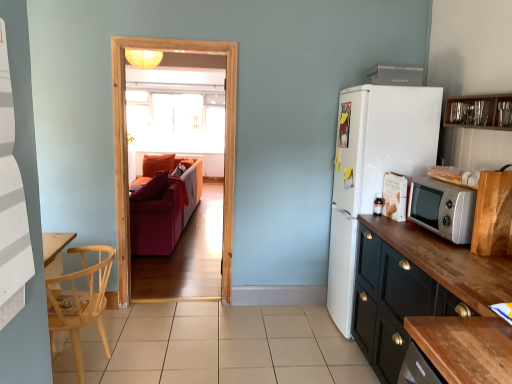
In order to face white matte refrigerator at right, should I rotate leftwards or rightwards?

To face it directly, rotate right by 16.661 degrees.

What is the approximate width of velvet red couch at center?

The width of velvet red couch at center is 3.47 feet.

I want to click on white plastic microwave at upper right, so click(395, 74).

What do you see at coordinates (442, 208) in the screenshot?
I see `silver metallic microwave oven at right` at bounding box center [442, 208].

What do you see at coordinates (392, 303) in the screenshot? I see `black wood cabinet at right, which is the third cabinetry from top to bottom` at bounding box center [392, 303].

At what (x,y) coordinates should I click in order to perform the action: click on white matte refrigerator at right. Please return your answer as a coordinate pair (x, y). The image size is (512, 384). Looking at the image, I should click on (373, 168).

Is point (495, 105) positioned before point (243, 321)?

Yes, it is.

Is clear glass cabinet at upper right, which appears as the third cabinetry when ordered from the bottom, aimed at beige tile at center?

No, clear glass cabinet at upper right, which appears as the third cabinetry when ordered from the bottom, does not turn towards beige tile at center.

Considering the sizes of objects clear glass cabinet at upper right, which appears as the third cabinetry when ordered from the bottom, and beige tile at center in the image provided, who is shorter, clear glass cabinet at upper right, which appears as the third cabinetry when ordered from the bottom, or beige tile at center?

Standing shorter between the two is beige tile at center.

From the image's perspective, who appears lower, clear glass cabinet at upper right, which is the first cabinetry in top-to-bottom order, or beige tile at center?

beige tile at center appears lower in the image.

Is white plastic microwave at upper right aimed at silver metallic microwave oven at right?

No.

How different are the orientations of white plastic microwave at upper right and silver metallic microwave oven at right in degrees?

The angle between the facing direction of white plastic microwave at upper right and the facing direction of silver metallic microwave oven at right is 11.7 degrees.

Consider the image. Which point is more forward, (413, 67) or (472, 226)?

Point (472, 226)

What's the angular difference between wooden cabinet at right, arranged as the second cabinetry when ordered from the bottom, and velvet red couch at center's facing directions?

The angular difference between wooden cabinet at right, arranged as the second cabinetry when ordered from the bottom, and velvet red couch at center is 8.83 degrees.

Considering the sizes of objects wooden cabinet at right, which ranks as the 2th cabinetry in top-to-bottom order, and velvet red couch at center in the image provided, who is smaller, wooden cabinet at right, which ranks as the 2th cabinetry in top-to-bottom order, or velvet red couch at center?

wooden cabinet at right, which ranks as the 2th cabinetry in top-to-bottom order, is smaller.

Which object is positioned more to the left, wooden cabinet at right, arranged as the second cabinetry when ordered from the bottom, or velvet red couch at center?

velvet red couch at center is more to the left.

Looking at this image, from a real-world perspective, does wooden cabinet at right, arranged as the second cabinetry when ordered from the bottom, stand above velvet red couch at center?

Yes, from a real-world perspective, wooden cabinet at right, arranged as the second cabinetry when ordered from the bottom, is above velvet red couch at center.

Is transparent glass door at center next to white matte refrigerator at right?

transparent glass door at center is not next to white matte refrigerator at right, and they're not touching.

From the image's perspective, would you say transparent glass door at center is shown under white matte refrigerator at right?

Actually, transparent glass door at center appears above white matte refrigerator at right in the image.

Which of these two, transparent glass door at center or white matte refrigerator at right, is wider?

white matte refrigerator at right is wider.

From a real-world perspective, is transparent glass door at center on white matte refrigerator at right?

Yes, from a real-world perspective, transparent glass door at center is over white matte refrigerator at right

In terms of width, does white matte refrigerator at right look wider or thinner when compared to natural wood chair at left?

white matte refrigerator at right is wider than natural wood chair at left.

Is natural wood chair at left at the back of white matte refrigerator at right?

No, white matte refrigerator at right's orientation is not away from natural wood chair at left.

Does white matte refrigerator at right come in front of natural wood chair at left?

No.

Is point (381, 144) positioned before point (98, 256)?

No, (381, 144) is behind (98, 256).

Who is bigger, silver metallic microwave oven at right or velvet red couch at center?

Bigger between the two is velvet red couch at center.

Is silver metallic microwave oven at right far from velvet red couch at center?

That's right, there is a large distance between silver metallic microwave oven at right and velvet red couch at center.

Who is taller, silver metallic microwave oven at right or velvet red couch at center?

velvet red couch at center is taller.

Does clear glass cabinet at upper right, which appears as the third cabinetry when ordered from the bottom, have a smaller size compared to clear glass window at center?

Yes.

Which is farther, (500, 107) or (208, 94)?

Positioned behind is point (208, 94).

From the image's perspective, is clear glass cabinet at upper right, which appears as the third cabinetry when ordered from the bottom, above or below clear glass window at center?

clear glass cabinet at upper right, which appears as the third cabinetry when ordered from the bottom, is situated lower than clear glass window at center in the image.

How many degrees apart are the facing directions of clear glass cabinet at upper right, which appears as the third cabinetry when ordered from the bottom, and clear glass window at center?

89.4 degrees separate the facing orientations of clear glass cabinet at upper right, which appears as the third cabinetry when ordered from the bottom, and clear glass window at center.

You are a GUI agent. You are given a task and a screenshot of the screen. Output one action in this format:
    pyautogui.click(x=<x>, y=<y>)
    Task: Click on the 3rd cabinetry above the beige tile at center (from a real-world perspective)
    Image resolution: width=512 pixels, height=384 pixels.
    Given the screenshot: What is the action you would take?
    pyautogui.click(x=480, y=111)

Where is `microwave oven located in front of the white plastic microwave at upper right`? microwave oven located in front of the white plastic microwave at upper right is located at coordinates (442, 208).

Considering their positions, is white matte refrigerator at right positioned further to clear glass window at center than silver metallic microwave oven at right?

silver metallic microwave oven at right lies further to clear glass window at center than the other object.

Considering their positions, is white plastic microwave at upper right positioned further to wooden cabinet at right, arranged as the second cabinetry when ordered from the bottom, than velvet red couch at center?

Based on the image, velvet red couch at center appears to be further to wooden cabinet at right, arranged as the second cabinetry when ordered from the bottom.

Which object lies further to the anchor point wooden cabinet at right, which ranks as the 2th cabinetry in top-to-bottom order, beige tile at center or black wood cabinet at right, which appears as the first cabinetry when ordered from the bottom?

beige tile at center.

From the image, which object appears to be farther from beige tile at center, transparent glass door at center or white plastic microwave at upper right?

white plastic microwave at upper right is positioned further to the anchor beige tile at center.

When comparing their distances from clear glass cabinet at upper right, which is the first cabinetry in top-to-bottom order, does wooden cabinet at right, arranged as the second cabinetry when ordered from the bottom, or white plastic microwave at upper right seem closer?

Among the two, white plastic microwave at upper right is located nearer to clear glass cabinet at upper right, which is the first cabinetry in top-to-bottom order.

Looking at the image, which one is located further to white matte refrigerator at right, silver metallic microwave oven at right or natural wood chair at left?

natural wood chair at left.

Looking at this image, from the image, which object appears to be farther from natural wood chair at left, beige tile at center or transparent glass door at center?

transparent glass door at center is positioned further to the anchor natural wood chair at left.

Looking at the image, which one is located further to clear glass cabinet at upper right, which appears as the third cabinetry when ordered from the bottom, wooden cabinet at right, arranged as the second cabinetry when ordered from the bottom, or black wood cabinet at right, which appears as the first cabinetry when ordered from the bottom?

black wood cabinet at right, which appears as the first cabinetry when ordered from the bottom.

The height and width of the screenshot is (384, 512). Find the location of `appliance between transparent glass door at center and clear glass cabinet at upper right, which appears as the third cabinetry when ordered from the bottom, in the horizontal direction`. appliance between transparent glass door at center and clear glass cabinet at upper right, which appears as the third cabinetry when ordered from the bottom, in the horizontal direction is located at coordinates (395, 74).

The width and height of the screenshot is (512, 384). In order to click on appliance between silver metallic microwave oven at right and velvet red couch at center along the z-axis in this screenshot , I will do `click(395, 74)`.

Where is `tile between wooden cabinet at right, arranged as the second cabinetry when ordered from the bottom, and clear glass window at center from front to back`? This screenshot has height=384, width=512. tile between wooden cabinet at right, arranged as the second cabinetry when ordered from the bottom, and clear glass window at center from front to back is located at coordinates pos(222,346).

The image size is (512, 384). Find the location of `refrigerator positioned between black wood cabinet at right, which is the third cabinetry from top to bottom, and clear glass window at center from near to far`. refrigerator positioned between black wood cabinet at right, which is the third cabinetry from top to bottom, and clear glass window at center from near to far is located at coordinates (373, 168).